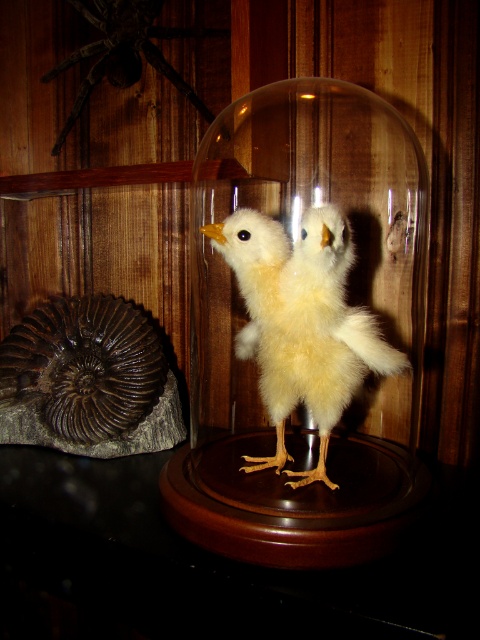
Question: Does yellow fluffy chicken at center have a smaller size compared to dark brown fuzzy spider at upper left?

Choices:
 (A) no
 (B) yes

Answer: (A)

Question: Which point is closer to the camera?

Choices:
 (A) (136, 51)
 (B) (288, 291)

Answer: (B)

Question: Is yellow fluffy chicken at center bigger than dark brown fuzzy spider at upper left?

Choices:
 (A) no
 (B) yes

Answer: (B)

Question: Among these points, which one is farthest from the camera?

Choices:
 (A) (85, 81)
 (B) (251, 348)

Answer: (A)

Question: Is yellow fluffy chicken at center wider than dark brown fuzzy spider at upper left?

Choices:
 (A) yes
 (B) no

Answer: (B)